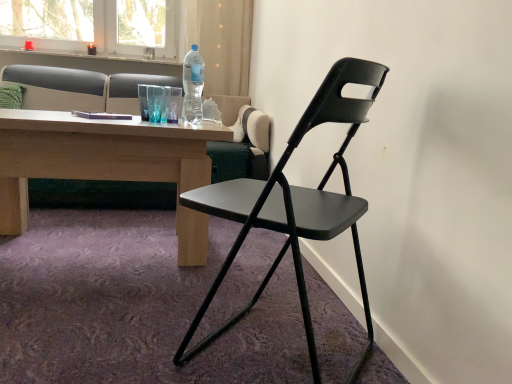
Where is `vacant area to the left of matte black folding chair at center`? vacant area to the left of matte black folding chair at center is located at coordinates (102, 331).